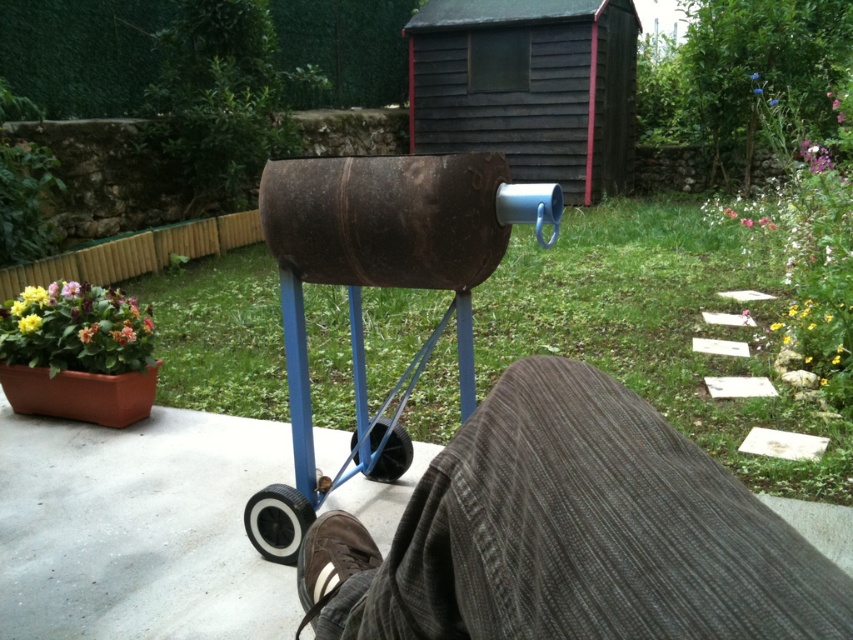
You are standing in the backyard and want to place a small potted plant between the two points labeled point (389, 252) and point (621, 163). Which point should the plant be closer to in order to be nearer to the viewer?

The plant should be closer to point (389, 252) because it is closer to the viewer than point (621, 163).

What is located at the point with coordinates (387,260) in the backyard scene?

The point at coordinates (387,260) marks the location of the rusty metal cart at center.

You are planning to place a new garden bench in the backyard. The bench is 1.5 meters long. You see the rusty metal cart at center and the rustic wood shed at upper center. Is there enough space between them to place the bench?

The rusty metal cart at center is positioned under rustic wood shed at upper center, so there might not be enough space between them to place the 1.5 meters long bench.